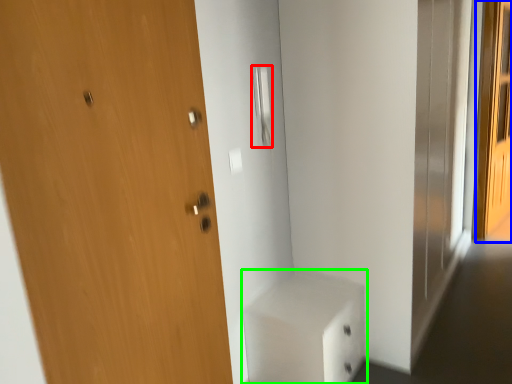
Question: Which object is positioned farthest from door handle (highlighted by a red box)? Select from screen door (highlighted by a blue box) and cabinetry (highlighted by a green box).

Choices:
 (A) screen door
 (B) cabinetry

Answer: (A)